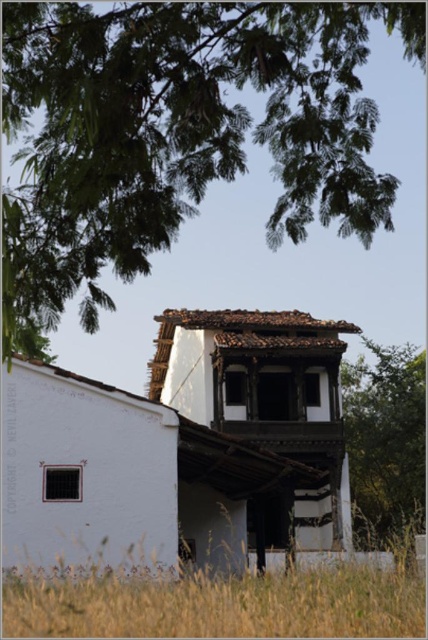
Is green leafy tree at upper center thinner than green leafy tree at center?

In fact, green leafy tree at upper center might be wider than green leafy tree at center.

Is the position of green leafy tree at upper center less distant than that of green leafy tree at center?

Yes, green leafy tree at upper center is in front of green leafy tree at center.

Which is behind, point (198, 10) or point (360, 397)?

Positioned behind is point (360, 397).

This screenshot has height=640, width=428. Find the location of `green leafy tree at upper center`. green leafy tree at upper center is located at coordinates (178, 131).

Does green leafy tree at upper center have a lesser height compared to green grass at lower left?

No.

What do you see at coordinates (178, 131) in the screenshot?
I see `green leafy tree at upper center` at bounding box center [178, 131].

Image resolution: width=428 pixels, height=640 pixels. What are the coordinates of `green leafy tree at upper center` in the screenshot? It's located at (178, 131).

Between green grass at lower left and green leafy tree at center, which one is positioned lower?

Positioned lower is green grass at lower left.

Find the location of a particular element. This screenshot has width=428, height=640. green grass at lower left is located at coordinates (217, 604).

Identify the location of green grass at lower left. The image size is (428, 640). (217, 604).